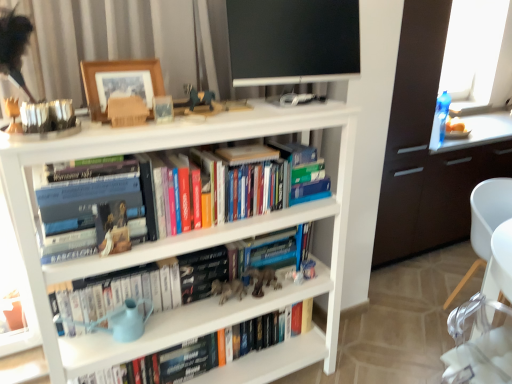
Question: Considering the positions of black glossy flat-screen tv at upper center and wooden picture frame at upper center in the image, is black glossy flat-screen tv at upper center bigger or smaller than wooden picture frame at upper center?

Choices:
 (A) big
 (B) small

Answer: (A)

Question: Based on their positions, is black glossy flat-screen tv at upper center located to the left or right of wooden picture frame at upper center?

Choices:
 (A) left
 (B) right

Answer: (B)

Question: Estimate the real-world distances between objects in this image. Which object is farther from the hardcover book at center?

Choices:
 (A) transparent glass window at upper right
 (B) metallic silver figurine at center
 (C) white plastic chair at lower right
 (D) black glossy flat-screen tv at upper center
 (E) hardcover books at center

Answer: (A)

Question: Which object is positioned closest to the hardcover book at center?

Choices:
 (A) white plastic chair at lower right
 (B) black glossy flat-screen tv at upper center
 (C) dark wood cabinet at right
 (D) hardcover books at center
 (E) metallic silver figurine at center

Answer: (E)